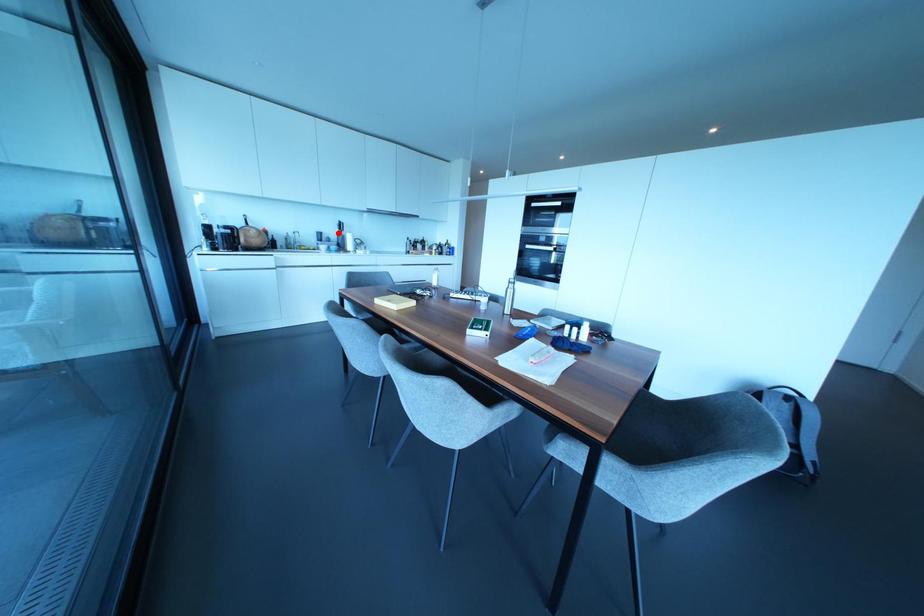
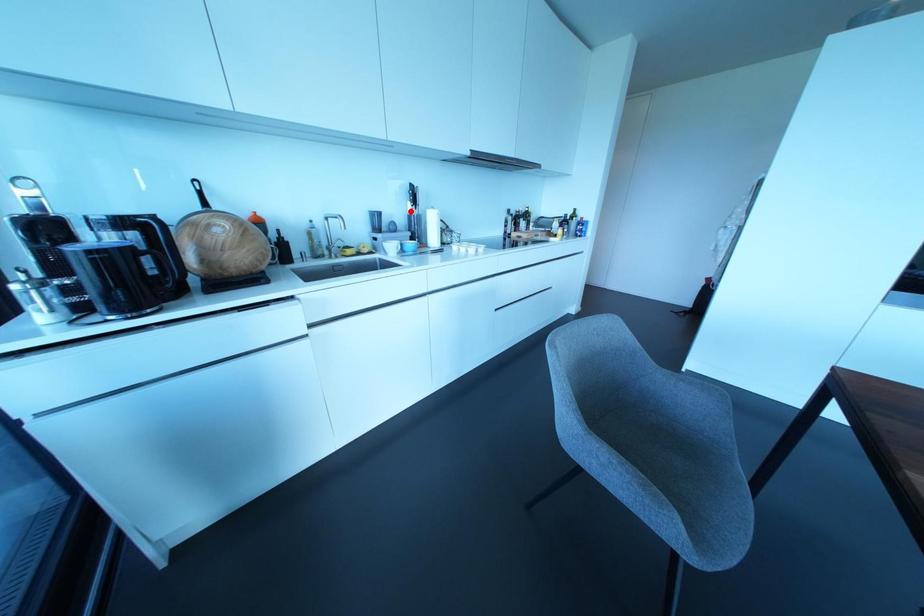
I am providing you with two images of the same scene from different viewpoints. A red point is marked on the first image and another point is marked on the second image. Do the highlighted points in image1 and image2 indicate the same real-world spot?

Yes